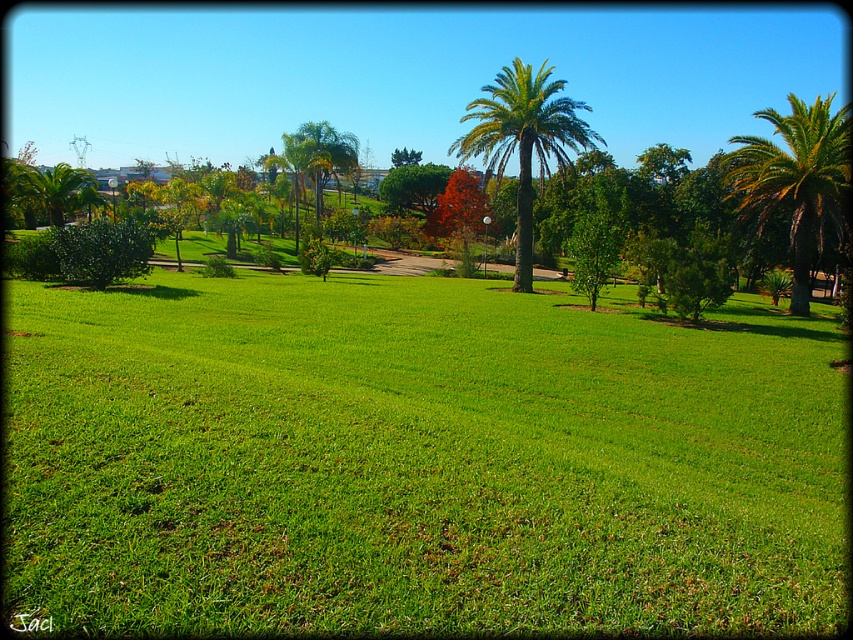
In the scene shown: You are planning to set up a picnic blanket in the park. The picnic blanket is 2 meters wide. You see the green grass at center and the green leafy palm tree at right. Which area can accommodate the blanket without overlapping the tree?

The green grass at center has a width less than the green leafy palm tree at right, so the green grass at center cannot accommodate the 2 meter wide picnic blanket. Choose the area near the green leafy palm tree at right instead.

Consider the image. You are a gardener assessing the park layout. You notice the green leafy palm tree at right and the green leafy palm at center. Which palm tree is shorter?

The green leafy palm tree at right is not as tall as the green leafy palm at center, so the palm tree at right is shorter.

Looking at this image, you are standing in the park and want to walk from the green grass at center to the green leafy palm tree at right. Which direction should you move?

You should move to the right because the green grass at center is to the left of the green leafy palm tree at right, so moving right will take you towards the palm tree.